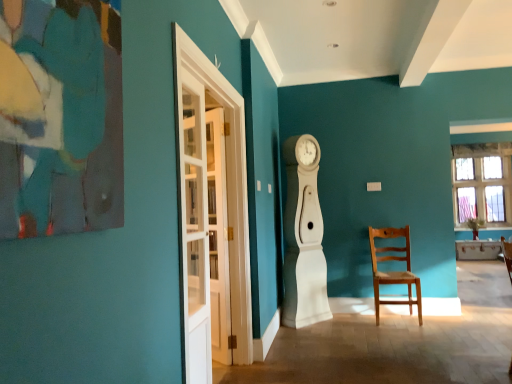
Question: Is white glass door at left, marked as the 2th glass door in a front-to-back arrangement, closer to the viewer compared to light brown wooden chair at center right?

Choices:
 (A) yes
 (B) no

Answer: (A)

Question: From the image's perspective, is white glass door at left, the first glass door in the back-to-front sequence, above light brown wooden chair at center right?

Choices:
 (A) no
 (B) yes

Answer: (B)

Question: Can you confirm if white glass door at left, the first glass door in the back-to-front sequence, is smaller than light brown wooden chair at center right?

Choices:
 (A) no
 (B) yes

Answer: (B)

Question: Could light brown wooden chair at center right be considered to be inside white glass door at left, the first glass door in the back-to-front sequence?

Choices:
 (A) yes
 (B) no

Answer: (B)

Question: Is white glass door at left, the first glass door in the back-to-front sequence, located outside light brown wooden chair at center right?

Choices:
 (A) yes
 (B) no

Answer: (A)

Question: Is the depth of white glass door at left, the first glass door in the back-to-front sequence, greater than that of light brown wooden chair at center right?

Choices:
 (A) yes
 (B) no

Answer: (B)

Question: Can you confirm if white wooden door at left is bigger than light brown wooden chair at center right?

Choices:
 (A) no
 (B) yes

Answer: (A)

Question: Does white wooden door at left have a lesser width compared to light brown wooden chair at center right?

Choices:
 (A) no
 (B) yes

Answer: (B)

Question: Is white wooden door at left further to the viewer compared to light brown wooden chair at center right?

Choices:
 (A) yes
 (B) no

Answer: (B)

Question: Is white wooden door at left taller than light brown wooden chair at center right?

Choices:
 (A) yes
 (B) no

Answer: (A)

Question: Is white wooden door at left to the left of light brown wooden chair at center right from the viewer's perspective?

Choices:
 (A) yes
 (B) no

Answer: (A)

Question: From a real-world perspective, is white wooden door at left positioned under light brown wooden chair at center right based on gravity?

Choices:
 (A) no
 (B) yes

Answer: (A)

Question: Is white wooden door at left positioned behind white glass door at left, the 2th glass door from the back?

Choices:
 (A) yes
 (B) no

Answer: (A)